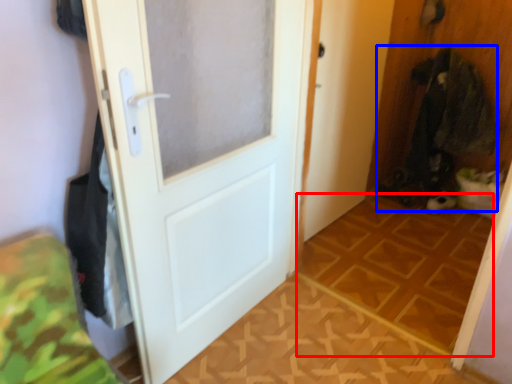
Question: Among these objects, which one is farthest to the camera, tile (highlighted by a red box) or laundry (highlighted by a blue box)?

Choices:
 (A) tile
 (B) laundry

Answer: (B)